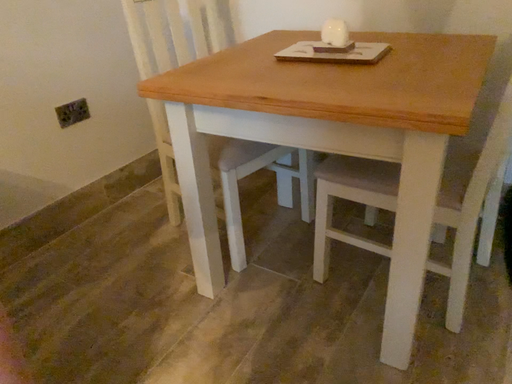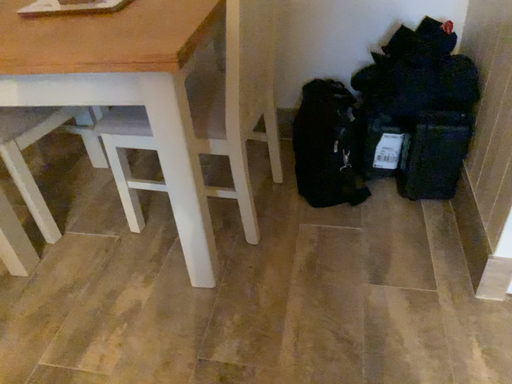
Question: Which way did the camera rotate in the video?

Choices:
 (A) rotated left
 (B) rotated right

Answer: (B)